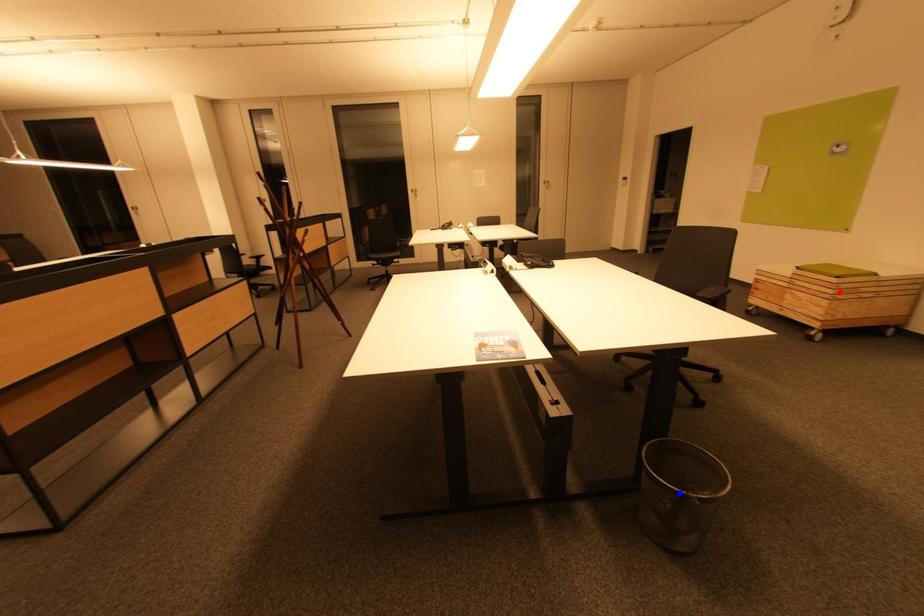
Question: Two points are marked on the image. Which point is closer to the camera?

Choices:
 (A) Blue point is closer.
 (B) Red point is closer.

Answer: (A)